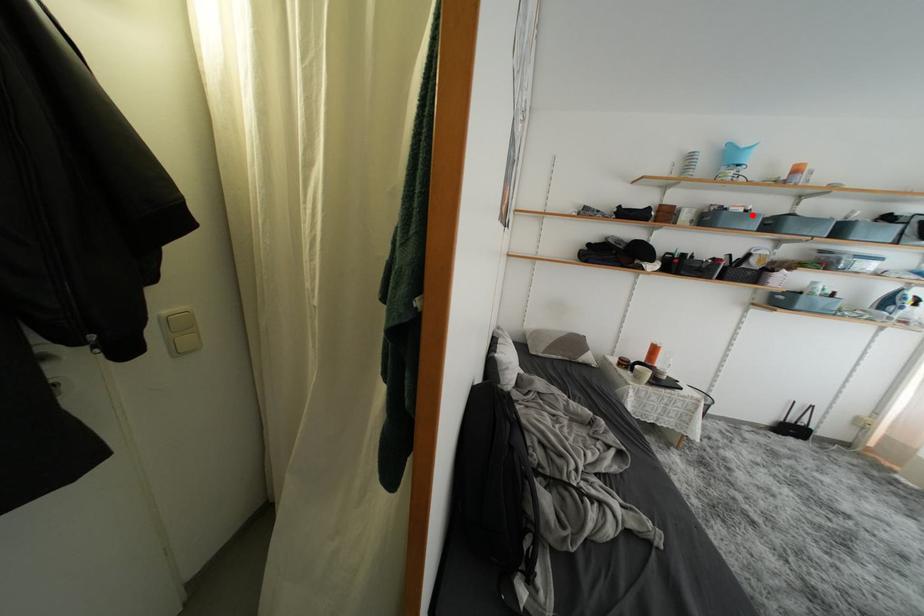
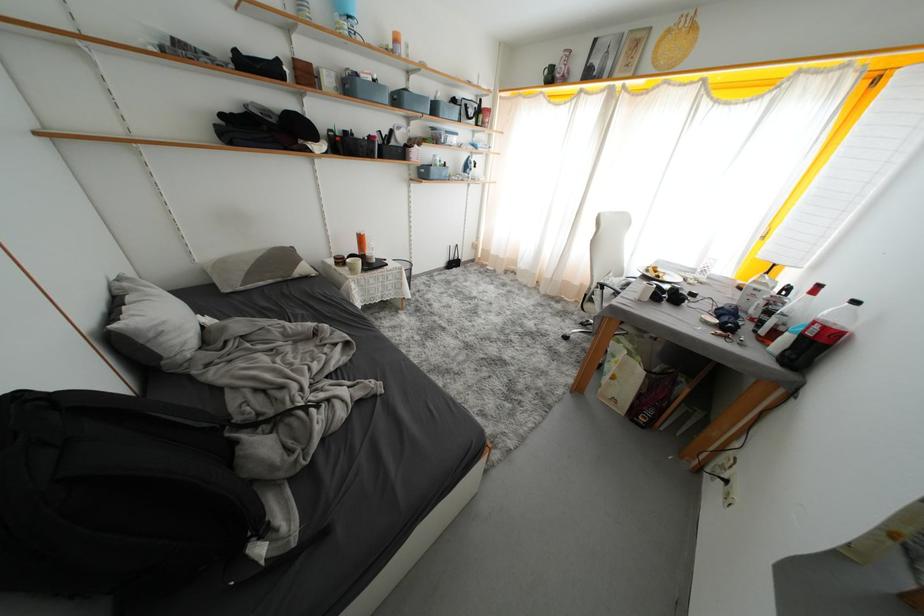
Where in the second image is the point corresponding to the highlighted location from the first image?

(381, 84)